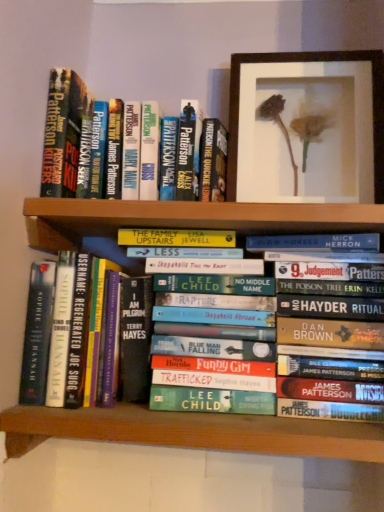
Question: Are hardcover book at upper left, which is counted as the first book, starting from the top, and hardcover book at center, the 2th book when ordered from top to bottom, located far from each other?

Choices:
 (A) no
 (B) yes

Answer: (A)

Question: From the image's perspective, is hardcover book at upper left, which is counted as the first book, starting from the top, below hardcover book at center, marked as the second book in a bottom-to-top arrangement?

Choices:
 (A) no
 (B) yes

Answer: (A)

Question: Can you confirm if hardcover book at upper left, which is counted as the first book, starting from the top, is thinner than hardcover book at center, marked as the second book in a bottom-to-top arrangement?

Choices:
 (A) yes
 (B) no

Answer: (A)

Question: Does hardcover book at upper left, which is counted as the first book, starting from the top, have a lesser height compared to hardcover book at center, the 2th book when ordered from top to bottom?

Choices:
 (A) no
 (B) yes

Answer: (B)

Question: Is hardcover book at center, marked as the second book in a bottom-to-top arrangement, at the back of hardcover book at upper left, positioned as the third book in bottom-to-top order?

Choices:
 (A) yes
 (B) no

Answer: (B)

Question: Is the surface of hardcover book at upper left, which is counted as the first book, starting from the top, in direct contact with hardcover book at center, the 2th book when ordered from top to bottom?

Choices:
 (A) no
 (B) yes

Answer: (A)

Question: Could you tell me if hardcover book at center, the 2th book when ordered from top to bottom, is turned towards green matte bookshelf at lower center?

Choices:
 (A) no
 (B) yes

Answer: (A)

Question: Would you say hardcover book at center, marked as the second book in a bottom-to-top arrangement, contains green matte bookshelf at lower center?

Choices:
 (A) no
 (B) yes

Answer: (A)

Question: From the image's perspective, is hardcover book at center, the 2th book when ordered from top to bottom, beneath green matte bookshelf at lower center?

Choices:
 (A) yes
 (B) no

Answer: (B)

Question: Is hardcover book at center, marked as the second book in a bottom-to-top arrangement, outside green matte bookshelf at lower center?

Choices:
 (A) no
 (B) yes

Answer: (B)

Question: Does hardcover book at center, marked as the second book in a bottom-to-top arrangement, come in front of green matte bookshelf at lower center?

Choices:
 (A) yes
 (B) no

Answer: (B)

Question: Does hardcover book at center, marked as the second book in a bottom-to-top arrangement, have a lesser width compared to green matte bookshelf at lower center?

Choices:
 (A) yes
 (B) no

Answer: (A)

Question: Is green matte bookshelf at lower center not near hardcover book at center, marked as the second book in a bottom-to-top arrangement?

Choices:
 (A) no
 (B) yes

Answer: (A)